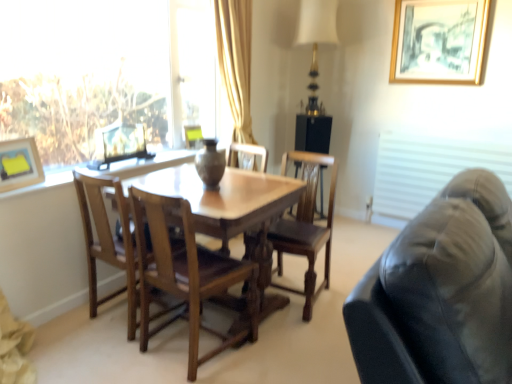
Image resolution: width=512 pixels, height=384 pixels. In order to click on blank area beneath gold-framed print at upper right, arranged as the third picture frame when ordered from the bottom (from a real-world perspective) in this screenshot , I will do `click(421, 129)`.